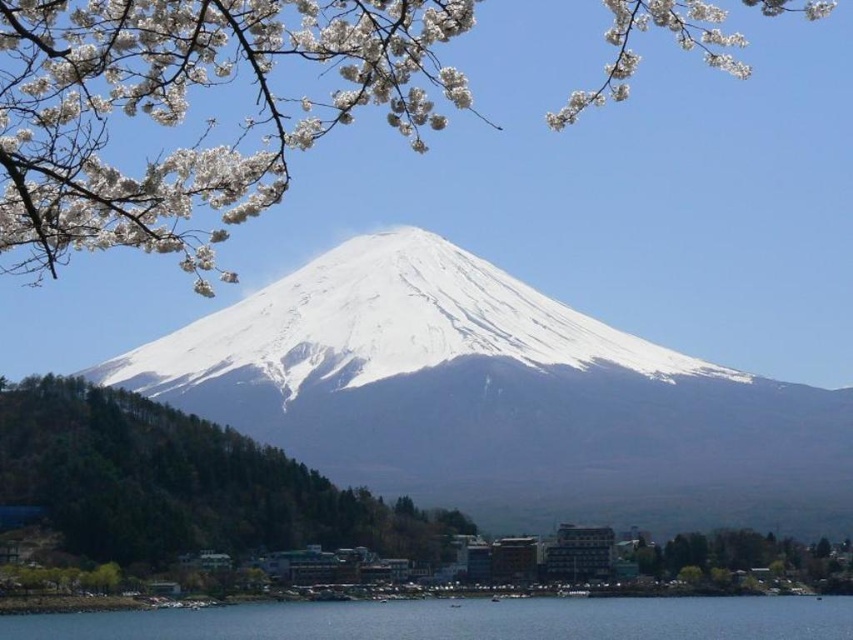
Question: Can you confirm if white snow-covered mountain at center is positioned to the right of clear blue water at lower center?

Choices:
 (A) no
 (B) yes

Answer: (B)

Question: Does white snow-covered mountain at center appear under green leafy tree at lower right?

Choices:
 (A) no
 (B) yes

Answer: (A)

Question: Which point is farther to the camera?

Choices:
 (A) white blossoms at upper center
 (B) clear blue water at lower center
 (C) white snow-covered mountain at center

Answer: (C)

Question: Based on their relative distances, which object is farther from the clear blue water at lower center?

Choices:
 (A) green leafy tree at lower right
 (B) white blossoms at upper center
 (C) white snow-covered mountain at center
 (D) green leafy tree at lower left

Answer: (B)

Question: Does white snow-covered mountain at center have a larger size compared to green leafy tree at lower right?

Choices:
 (A) no
 (B) yes

Answer: (B)

Question: Among these objects, which one is farthest from the camera?

Choices:
 (A) white snow-covered mountain at center
 (B) green leafy tree at lower right
 (C) green leafy tree at lower left

Answer: (A)